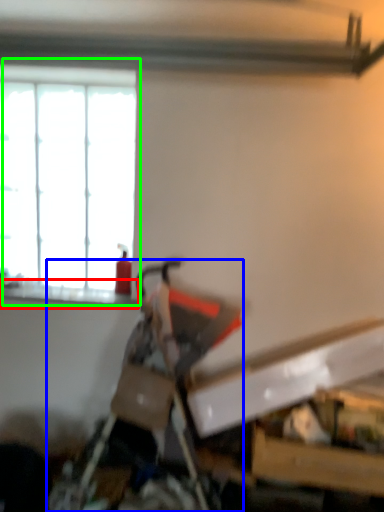
Question: Which object is positioned closest to window sill (highlighted by a red box)? Select from swivel chair (highlighted by a blue box) and window (highlighted by a green box).

Choices:
 (A) swivel chair
 (B) window

Answer: (B)